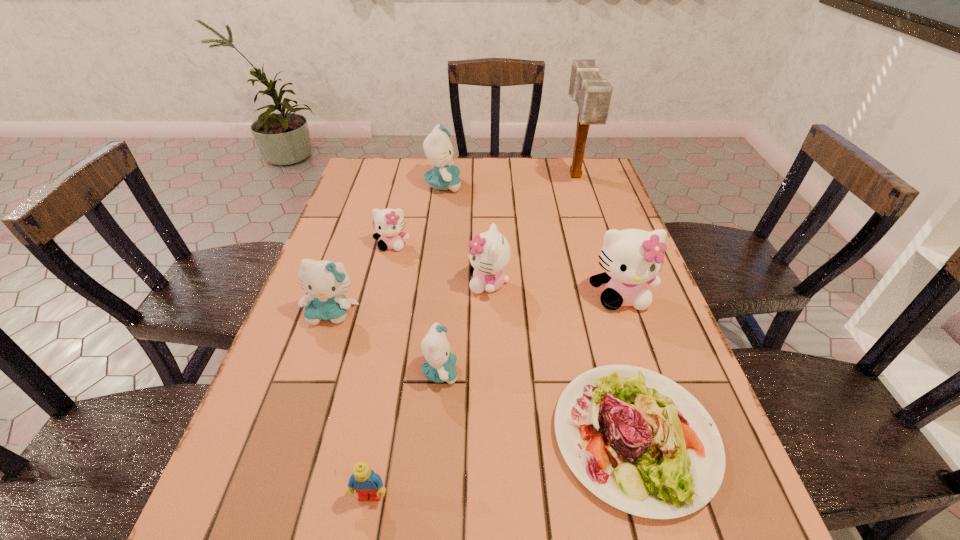
You are a GUI agent. You are given a task and a screenshot of the screen. Output one action in this format:
    pyautogui.click(x=<x>, y=<y>)
    Task: Click on the kitten that is at the far edge
    The width and height of the screenshot is (960, 540).
    Given the screenshot: What is the action you would take?
    pyautogui.click(x=437, y=146)

This screenshot has height=540, width=960. Find the location of `mallet situated at the right edge`. mallet situated at the right edge is located at coordinates (592, 94).

At what (x,y) coordinates should I click in order to perform the action: click on kitten at the right edge. Please return your answer as a coordinate pair (x, y). The height and width of the screenshot is (540, 960). Looking at the image, I should click on (631, 258).

Where is `salad plate that is at the right edge`? salad plate that is at the right edge is located at coordinates (671, 463).

You are a GUI agent. You are given a task and a screenshot of the screen. Output one action in this format:
    pyautogui.click(x=<x>, y=<y>)
    Task: Click on the object positioned at the far right corner
    This screenshot has height=540, width=960.
    Given the screenshot: What is the action you would take?
    point(592,94)

Identify the location of vacant space at the far edge of the desktop. The image size is (960, 540). pyautogui.click(x=530, y=183).

At what (x,y) coordinates should I click in order to perform the action: click on free space at the left edge of the desktop. Please return your answer as a coordinate pair (x, y). Looking at the image, I should click on [297, 509].

Locate an element on the screen. Image resolution: width=960 pixels, height=540 pixels. free space at the right edge of the desktop is located at coordinates (647, 287).

Where is `free space at the far left corner`? This screenshot has width=960, height=540. free space at the far left corner is located at coordinates (399, 161).

Find the location of a particular element. vacant region at the far right corner of the desktop is located at coordinates (588, 185).